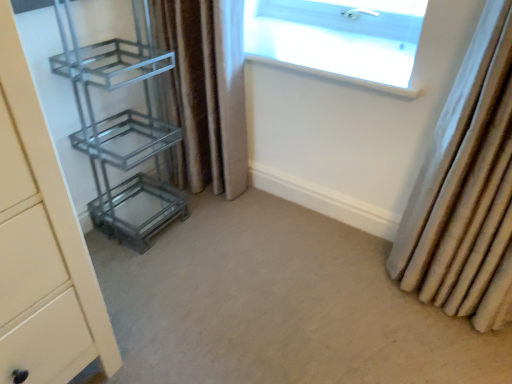
The width and height of the screenshot is (512, 384). I want to click on vacant region in front of beige fabric curtain at right, which is counted as the 1th curtain, starting from the right, so click(x=448, y=347).